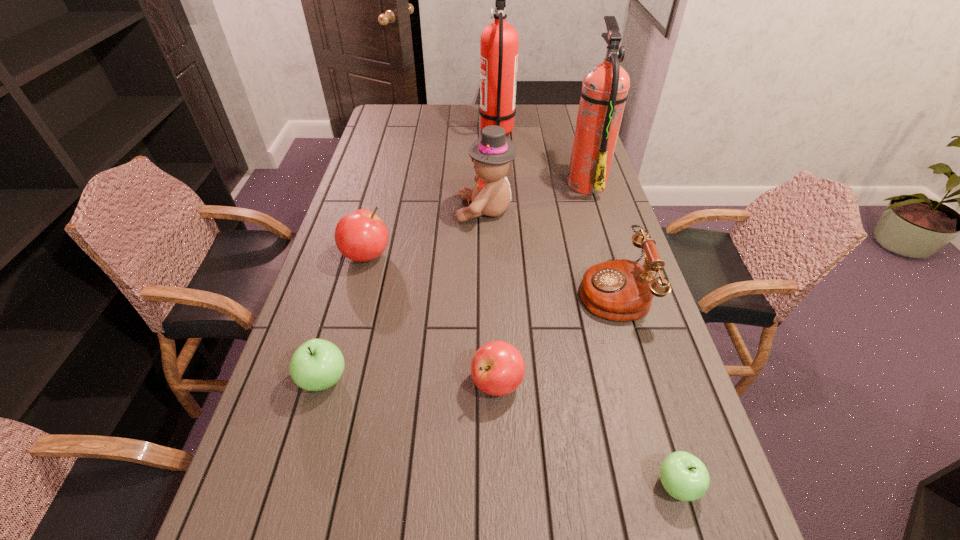
Image resolution: width=960 pixels, height=540 pixels. What are the coordinates of `empty location between the smaller red apple and the bigger red apple` in the screenshot? It's located at (432, 319).

You are a GUI agent. You are given a task and a screenshot of the screen. Output one action in this format:
    pyautogui.click(x=<x>, y=<y>)
    Task: Click on the free space between the shortest apple and the telephone
    
    Given the screenshot: What is the action you would take?
    pyautogui.click(x=644, y=388)

What are the coordinates of `vacant region between the telephone and the nearest object` in the screenshot? It's located at (644, 388).

I want to click on free space between the smaller red apple and the farthest object, so click(x=497, y=258).

Where is `free space that is in between the smaller red apple and the nearer fire extinguisher`? free space that is in between the smaller red apple and the nearer fire extinguisher is located at coordinates (541, 283).

I want to click on vacant point located between the left green apple and the nearer fire extinguisher, so click(455, 281).

Where is `object that can be found as the third closest to the left green apple`? object that can be found as the third closest to the left green apple is located at coordinates (491, 154).

The image size is (960, 540). In order to click on the third closest object to the right red apple in this screenshot , I will do `click(317, 364)`.

The height and width of the screenshot is (540, 960). Identify the location of apple that is the third closest to the farthest object. 317,364.

Where is `apple object that ranks as the third closest to the telephone`? apple object that ranks as the third closest to the telephone is located at coordinates (361, 236).